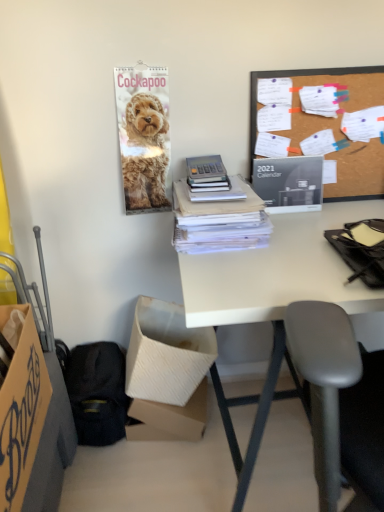
Question: Is black glossy calendar at upper right to the left or to the right of white cardboard box at lower left, which is counted as the 2th box, starting from the front, in the image?

Choices:
 (A) right
 (B) left

Answer: (A)

Question: Which is correct: black glossy calendar at upper right is inside white cardboard box at lower left, the 2th box from the back, or outside of it?

Choices:
 (A) inside
 (B) outside

Answer: (B)

Question: Based on their relative distances, which object is farther from the black fabric handbag at lower left?

Choices:
 (A) black glossy calendar at upper right
 (B) cardboard box at lower left, which appears as the third box when viewed from the back
 (C) white cardboard box at lower left, the 2th box from the back
 (D) white matte desk at center
 (E) burlap-like fabric at upper right

Answer: (E)

Question: Estimate the real-world distances between objects in this image. Which object is farther from the white cardboard box at lower left, the 2th box from the back?

Choices:
 (A) white cardboard box at lower left, marked as the third box in a front-to-back arrangement
 (B) black glossy calendar at upper right
 (C) black fabric handbag at lower left
 (D) cardboard box at lower left, the 1th box from the front
 (E) burlap-like fabric at upper right

Answer: (E)